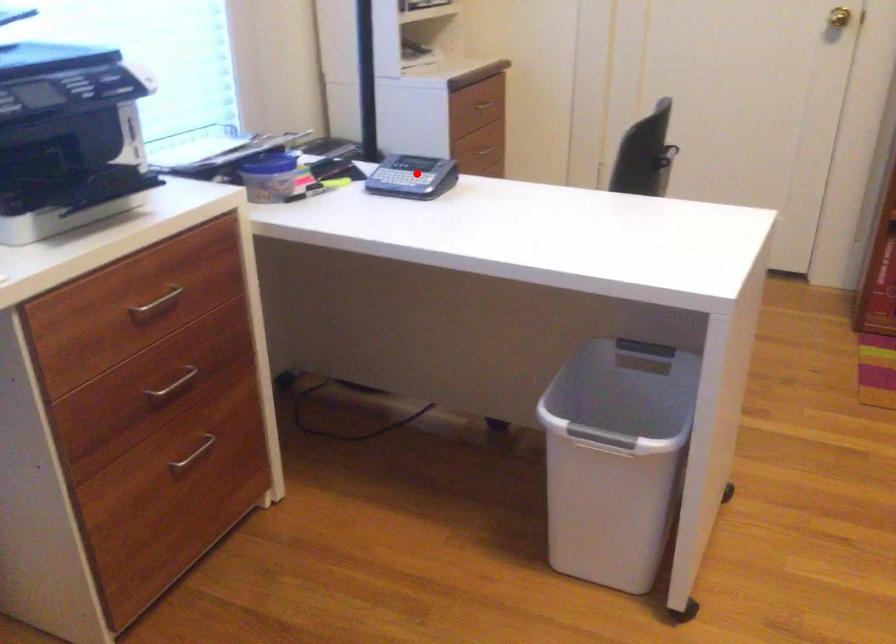
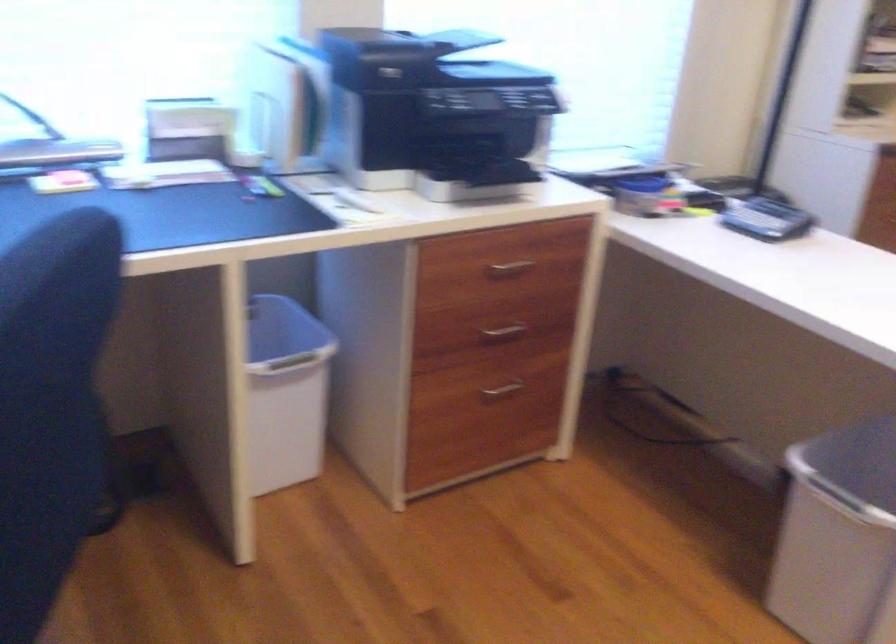
Locate, in the second image, the point that corresponds to the highlighted location in the first image.

(767, 220)